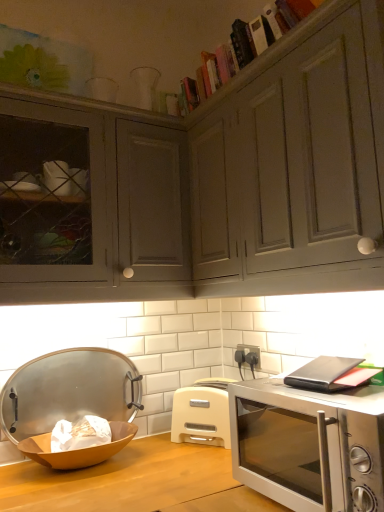
Question: From their relative heights in the image, would you say matte gray cabinet at upper center is taller or shorter than silver metallic microwave oven at lower right?

Choices:
 (A) tall
 (B) short

Answer: (A)

Question: Looking at the image, does matte gray cabinet at upper center seem bigger or smaller compared to silver metallic microwave oven at lower right?

Choices:
 (A) big
 (B) small

Answer: (A)

Question: Which of these objects is positioned farthest from the matte gray cabinet at upper left?

Choices:
 (A) matte gray cabinet at upper center
 (B) wooden bowl at lower left
 (C) silver metallic microwave oven at lower right
 (D) metallic silver tray at left
 (E) beige plastic toaster at center

Answer: (C)

Question: Which object is the farthest from the hardcover books at upper center?

Choices:
 (A) wooden bowl at lower left
 (B) metallic silver tray at left
 (C) matte gray cabinet at upper left
 (D) matte gray cabinet at upper center
 (E) beige plastic toaster at center

Answer: (A)